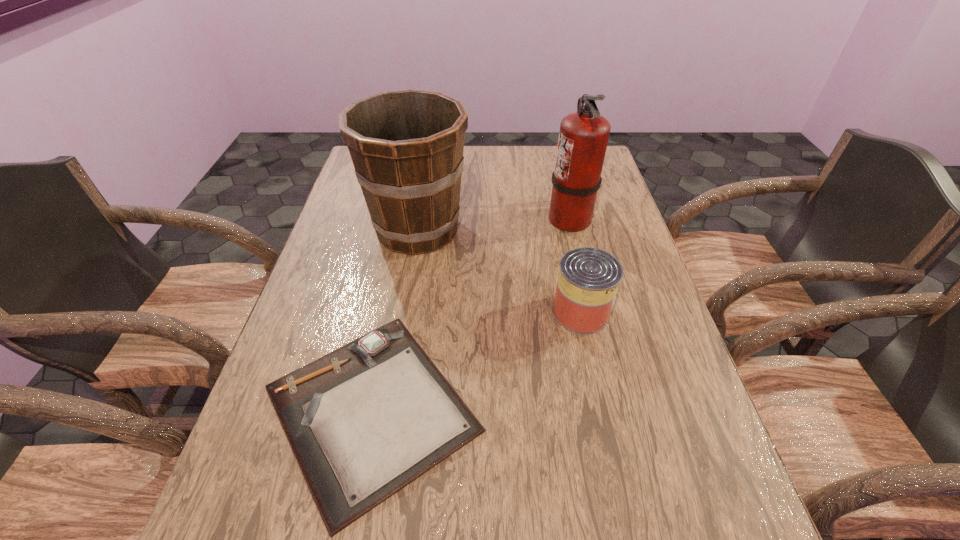
This screenshot has width=960, height=540. Identify the location of fire extinguisher. (583, 137).

The height and width of the screenshot is (540, 960). What are the coordinates of `bucket` in the screenshot? It's located at (407, 146).

I want to click on the third tallest object, so click(x=588, y=280).

You are a GUI agent. You are given a task and a screenshot of the screen. Output one action in this format:
    pyautogui.click(x=<x>, y=<y>)
    Task: Click on the clipboard
    
    Given the screenshot: What is the action you would take?
    pyautogui.click(x=364, y=421)

Where is `vacant space situated 0.250m toward the nozzle of the fire extinguisher`? The height and width of the screenshot is (540, 960). vacant space situated 0.250m toward the nozzle of the fire extinguisher is located at coordinates (463, 218).

You are a GUI agent. You are given a task and a screenshot of the screen. Output one action in this format:
    pyautogui.click(x=<x>, y=<y>)
    Task: Click on the vacant space located toward the nozzle of the fire extinguisher
    The height and width of the screenshot is (540, 960).
    Given the screenshot: What is the action you would take?
    tap(514, 218)

Locate an element on the screen. blank space located 0.360m toward the nozzle of the fire extinguisher is located at coordinates (x=426, y=218).

I want to click on vacant region located on the right of the third shortest object, so click(x=526, y=230).

Identify the location of free region located on the front of the second shortest object. This screenshot has width=960, height=540. (601, 401).

Locate an element on the screen. vacant space located 0.270m on the back of the clipboard is located at coordinates (403, 246).